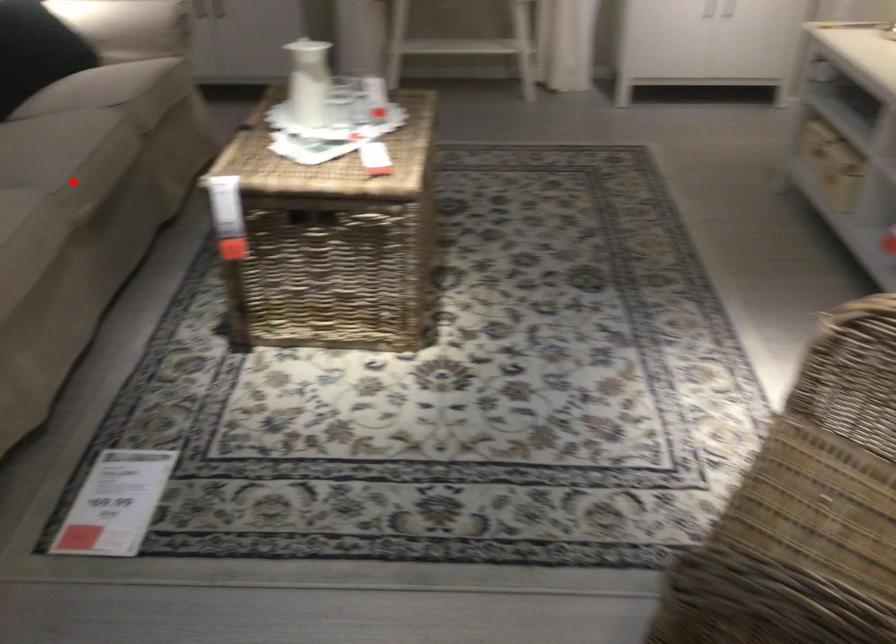
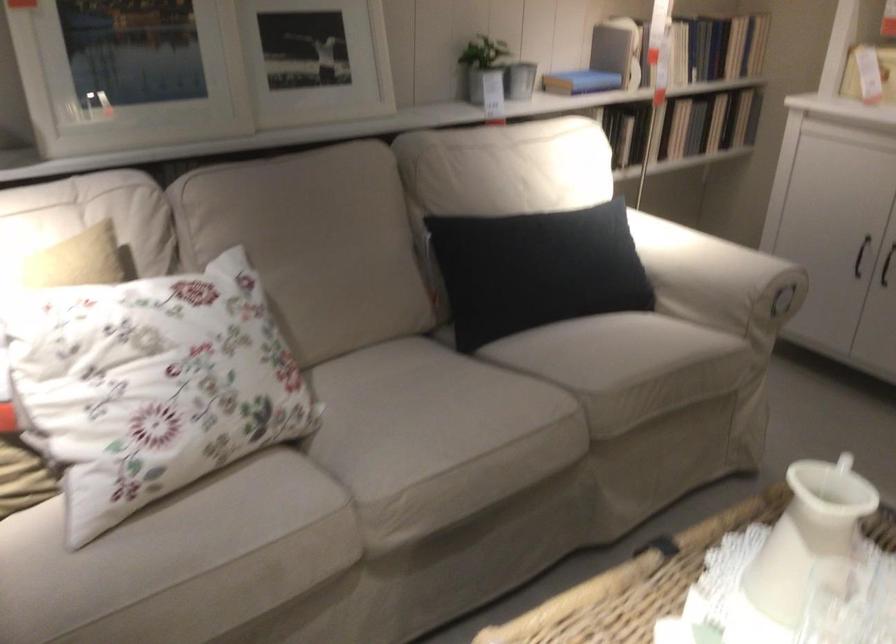
Locate, in the second image, the point that corresponds to the highlighted location in the first image.

(398, 494)